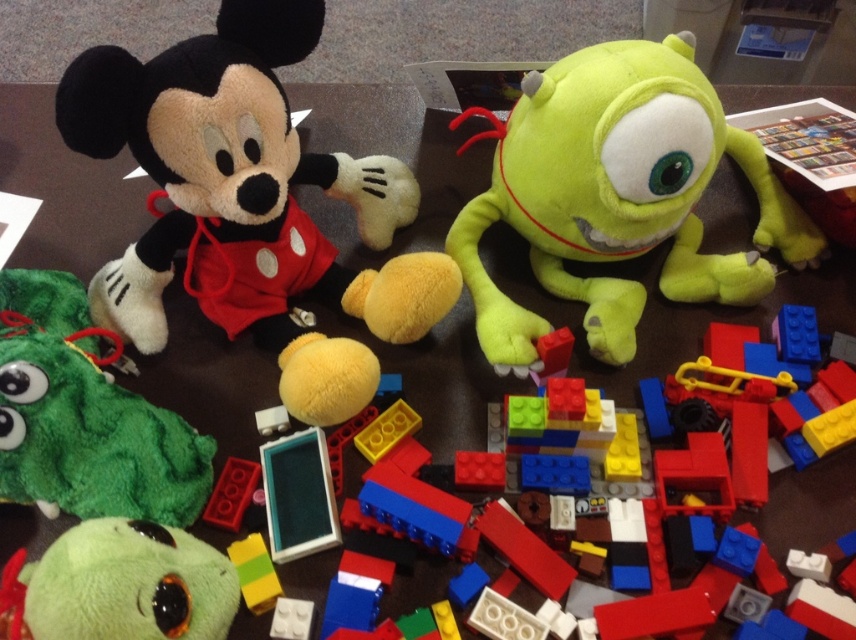
Question: Which point is closer to the camera taking this photo?

Choices:
 (A) (85, 67)
 (B) (64, 413)

Answer: (A)

Question: Does green fuzzy plush at lower left appear under green plush toy at lower left?

Choices:
 (A) yes
 (B) no

Answer: (B)

Question: Estimate the real-world distances between objects in this image. Which object is farther from the green plush toy at lower left?

Choices:
 (A) green fuzzy plush at lower left
 (B) green plush toy at center
 (C) soft plush mickey mouse at upper left

Answer: (B)

Question: Which point is farther to the camera?

Choices:
 (A) (64, 604)
 (B) (789, 248)

Answer: (B)

Question: Can you confirm if green plush toy at center is positioned below green fuzzy plush at lower left?

Choices:
 (A) no
 (B) yes

Answer: (A)

Question: Is green plush toy at center closer to camera compared to green plush toy at lower left?

Choices:
 (A) no
 (B) yes

Answer: (A)